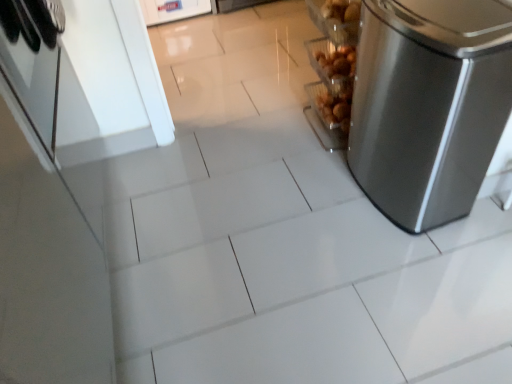
This screenshot has width=512, height=384. I want to click on vacant area that is situated to the right of satin silver trash can at right, so click(472, 181).